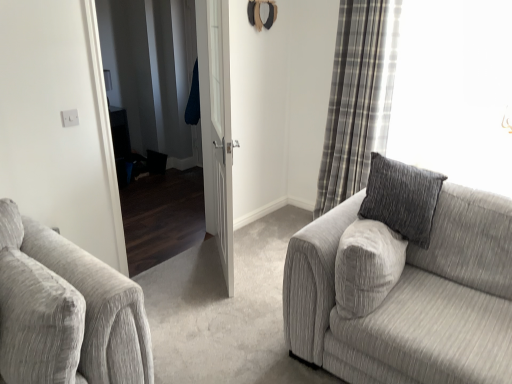
Question: From a real-world perspective, is plaid fabric curtain at right under textured gray couch at right?

Choices:
 (A) yes
 (B) no

Answer: (B)

Question: Could textured gray couch at right be considered to be inside plaid fabric curtain at right?

Choices:
 (A) no
 (B) yes

Answer: (A)

Question: Does plaid fabric curtain at right appear on the left side of textured gray couch at right?

Choices:
 (A) yes
 (B) no

Answer: (A)

Question: From the image's perspective, does plaid fabric curtain at right appear lower than textured gray couch at right?

Choices:
 (A) yes
 (B) no

Answer: (B)

Question: Considering the relative sizes of plaid fabric curtain at right and textured gray couch at right in the image provided, is plaid fabric curtain at right shorter than textured gray couch at right?

Choices:
 (A) yes
 (B) no

Answer: (B)

Question: Choose the correct answer: Is textured gray couch at right inside white wooden door at center or outside it?

Choices:
 (A) inside
 (B) outside

Answer: (B)

Question: Is textured gray couch at right wider or thinner than white wooden door at center?

Choices:
 (A) thin
 (B) wide

Answer: (B)

Question: In terms of size, does textured gray couch at right appear bigger or smaller than white wooden door at center?

Choices:
 (A) big
 (B) small

Answer: (A)

Question: From the image's perspective, relative to white wooden door at center, is textured gray couch at right above or below?

Choices:
 (A) below
 (B) above

Answer: (A)

Question: From a real-world perspective, is white wooden door at center physically located above or below plaid fabric curtain at right?

Choices:
 (A) below
 (B) above

Answer: (A)

Question: From the image's perspective, relative to plaid fabric curtain at right, is white wooden door at center above or below?

Choices:
 (A) below
 (B) above

Answer: (A)

Question: Do you think white wooden door at center is within plaid fabric curtain at right, or outside of it?

Choices:
 (A) inside
 (B) outside

Answer: (B)

Question: In terms of height, does white wooden door at center look taller or shorter compared to plaid fabric curtain at right?

Choices:
 (A) tall
 (B) short

Answer: (B)

Question: Considering the positions of white wooden door at center and textured gray couch at right in the image, is white wooden door at center wider or thinner than textured gray couch at right?

Choices:
 (A) wide
 (B) thin

Answer: (B)

Question: Would you say white wooden door at center is to the left or to the right of textured gray couch at right in the picture?

Choices:
 (A) left
 (B) right

Answer: (A)